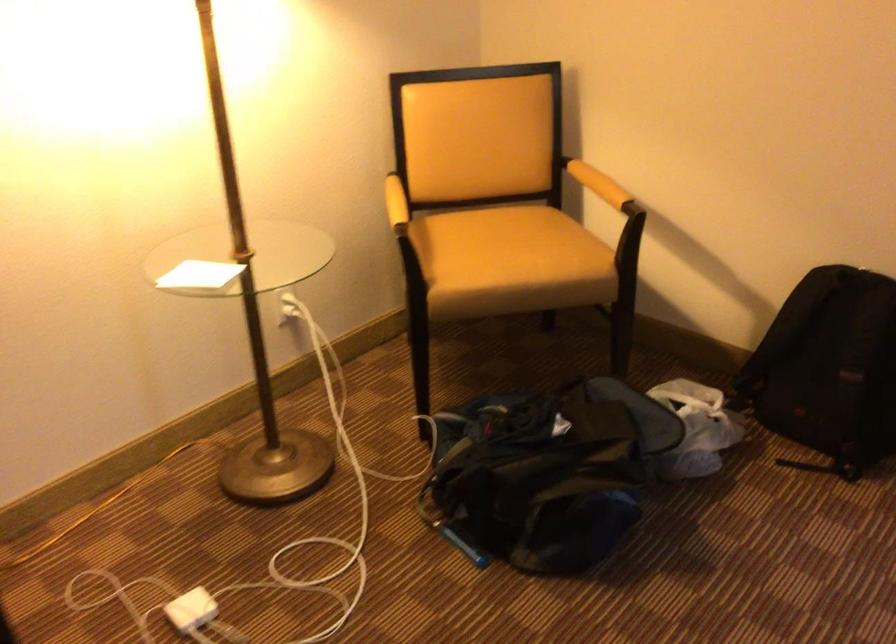
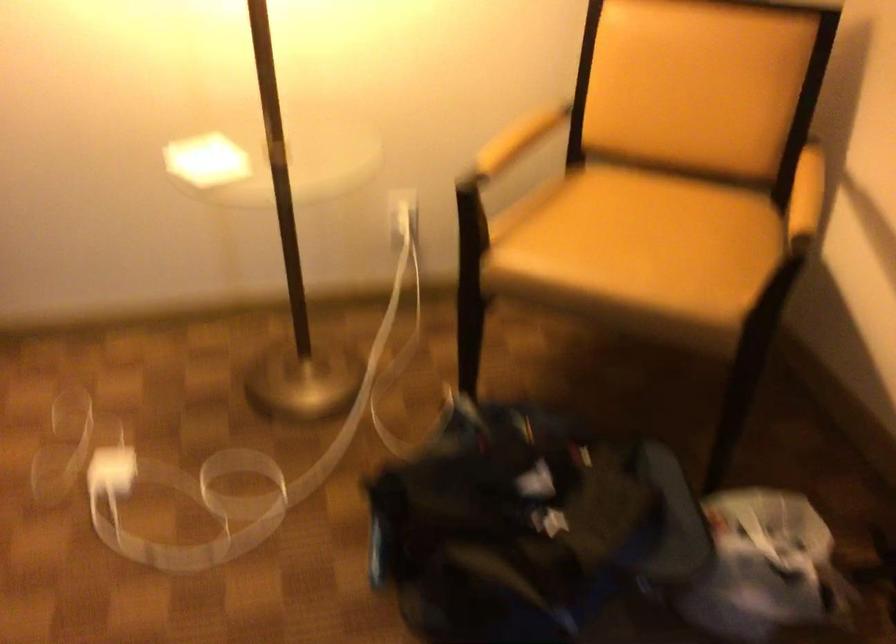
Question: The images are taken continuously from a first-person perspective. In which direction is your viewpoint rotating?

Choices:
 (A) Left
 (B) Right
 (C) Up
 (D) Down

Answer: (A)